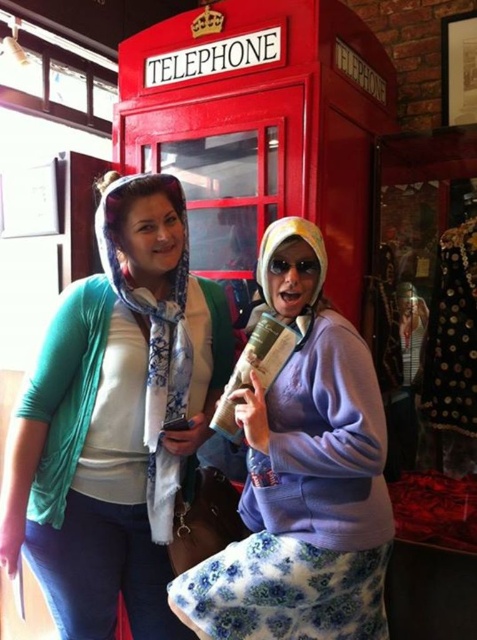
Is point (72, 396) more distant than point (356, 548)?

Yes, it is behind point (356, 548).

Measure the distance from matte blue scarf at center to purple fleece jacket at center.

matte blue scarf at center and purple fleece jacket at center are 12.22 inches apart.

Between point (131, 275) and point (328, 444), which one is positioned behind?

Point (131, 275)

I want to click on matte blue scarf at center, so pos(116,419).